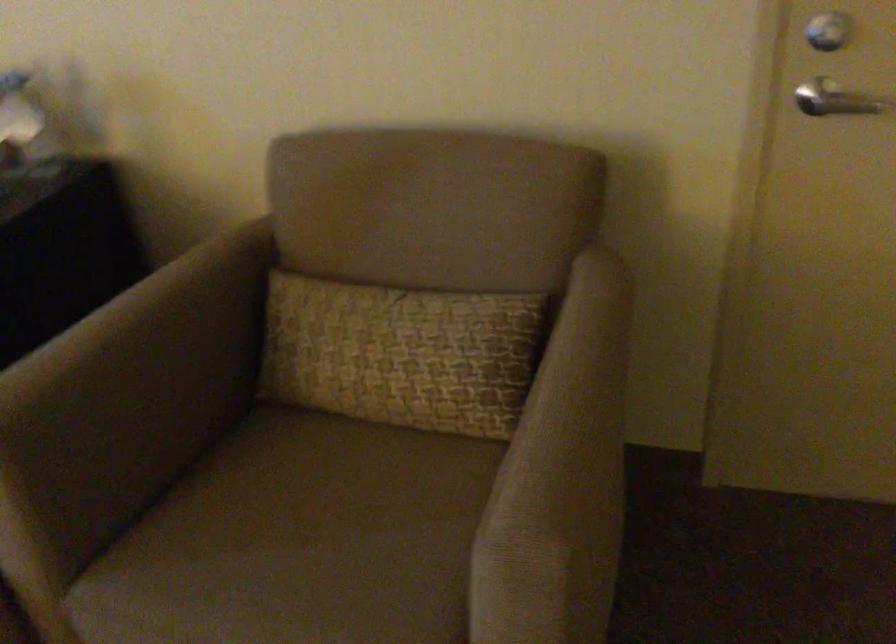
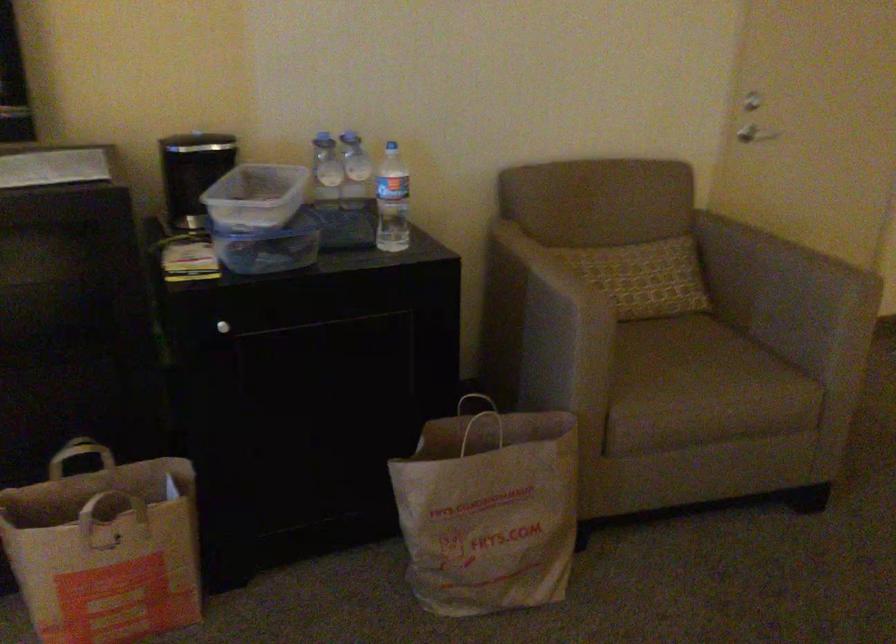
Where in the second image is the point corresponding to point 823,115 from the first image?

(760, 135)